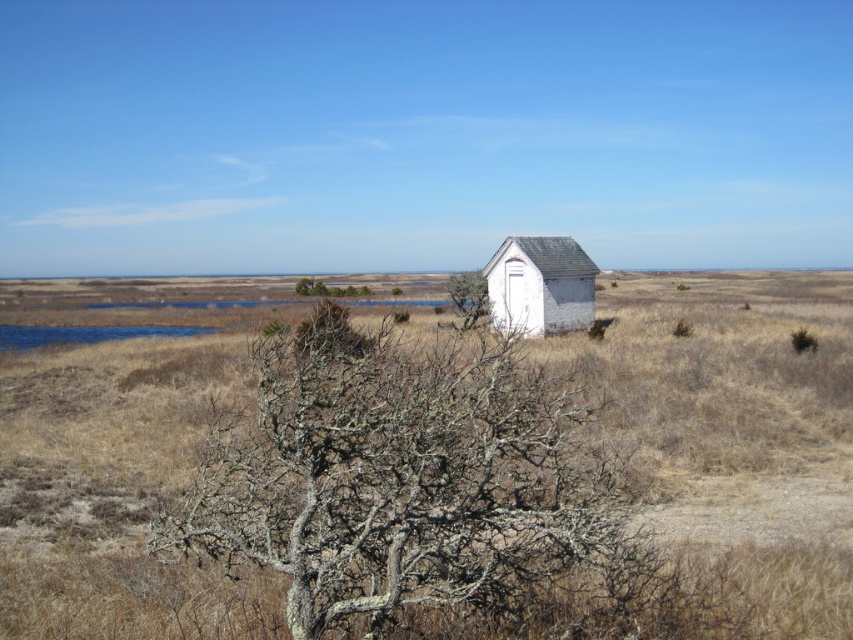
You are planning to build a new garden shed in your backyard. You want to ensure it doesn t block the view of the green mossy tree at center from your house. Given that the white wood hut at center is currently in the way, can you move the hut to a different location so that the tree remains visible without any obstruction?

The white wood hut at center occupies less space than green mossy tree at center. Since the hut is smaller, you can move it to a different location while keeping the tree visible. The smaller size allows for easier repositioning without blocking the view.